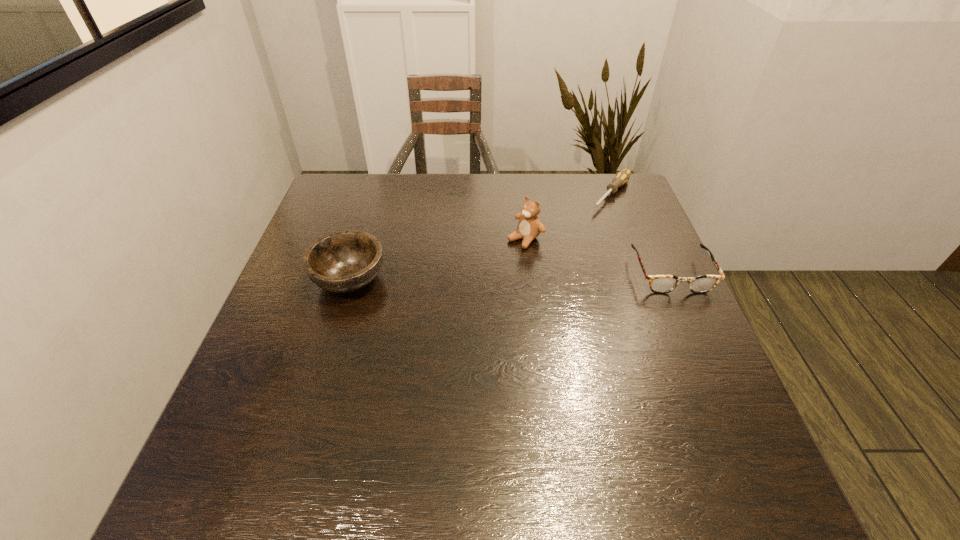
Locate an element on the screen. This screenshot has height=540, width=960. vacant space positioned 0.060m at the tip of the screwdriver is located at coordinates (593, 220).

Identify the location of free spot located 0.160m at the tip of the screwdriver. This screenshot has width=960, height=540. (577, 237).

The image size is (960, 540). I want to click on vacant space located 0.390m on the front-facing side of the third nearest object, so click(402, 333).

The width and height of the screenshot is (960, 540). In order to click on vacant position located 0.340m on the front-facing side of the third nearest object in this screenshot , I will do `click(419, 320)`.

The image size is (960, 540). Identify the location of free location located 0.210m on the front-facing side of the third nearest object. (459, 289).

You are a GUI agent. You are given a task and a screenshot of the screen. Output one action in this format:
    pyautogui.click(x=<x>, y=<y>)
    Task: Click on the object that is at the far edge
    
    Given the screenshot: What is the action you would take?
    (622, 177)

I want to click on object that is positioned at the left edge, so click(x=344, y=261).

Find the location of a particular element. This screenshot has height=540, width=960. spectacles that is at the right edge is located at coordinates pos(660,284).

I want to click on screwdriver that is at the right edge, so click(x=622, y=177).

This screenshot has height=540, width=960. Find the location of `object at the far right corner`. object at the far right corner is located at coordinates (622, 177).